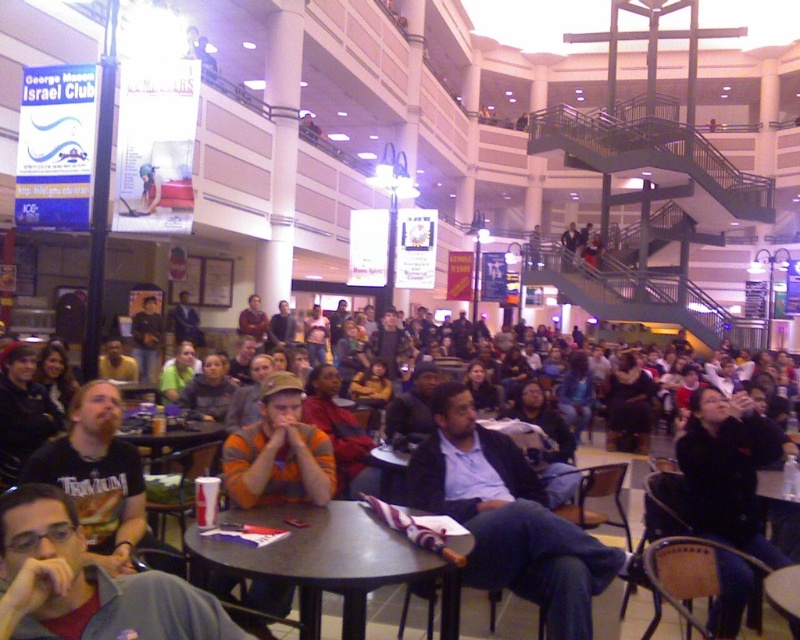
You are standing in the shopping mall and want to take a photo of both the point at coordinates point (472, 515) and the point at coordinates point (72, 474). Which point should you focus on first to ensure both are in focus?

You should focus on the point at coordinates point (472, 515) first because it is closer to the camera than point (72, 474), ensuring both will be in focus when using depth of field.